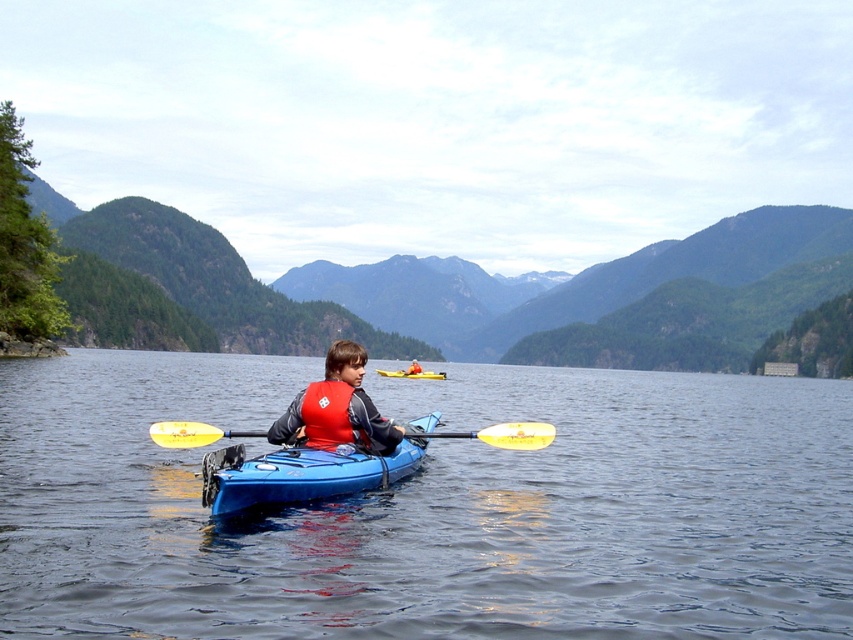
In the scene shown: Can you confirm if blue glossy water at center is thinner than blue plastic kayak at center?

In fact, blue glossy water at center might be wider than blue plastic kayak at center.

Is blue glossy water at center taller than blue plastic kayak at center?

Indeed, blue glossy water at center has a greater height compared to blue plastic kayak at center.

Identify the location of blue glossy water at center. (430, 508).

Is yellow foam paddle at center further to camera compared to yellow plastic kayak at center?

That is False.

Between yellow foam paddle at center and yellow plastic kayak at center, which one has less height?

yellow plastic kayak at center is shorter.

Does point (497, 428) come farther from viewer compared to point (398, 374)?

No, (497, 428) is closer to viewer.

Where is `yellow foam paddle at center`? yellow foam paddle at center is located at coordinates (502, 435).

Is red life vest at center bigger than yellow foam paddle at center?

Actually, red life vest at center might be smaller than yellow foam paddle at center.

Is red life vest at center above yellow foam paddle at center?

Yes.

You are a GUI agent. You are given a task and a screenshot of the screen. Output one action in this format:
    pyautogui.click(x=<x>, y=<y>)
    Task: Click on the red life vest at center
    The image size is (853, 640).
    Given the screenshot: What is the action you would take?
    pyautogui.click(x=337, y=408)